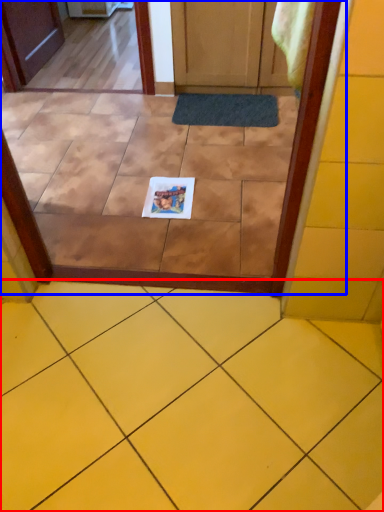
Question: Among these objects, which one is farthest to the camera, ceramic tile (highlighted by a red box) or glass door (highlighted by a blue box)?

Choices:
 (A) ceramic tile
 (B) glass door

Answer: (B)